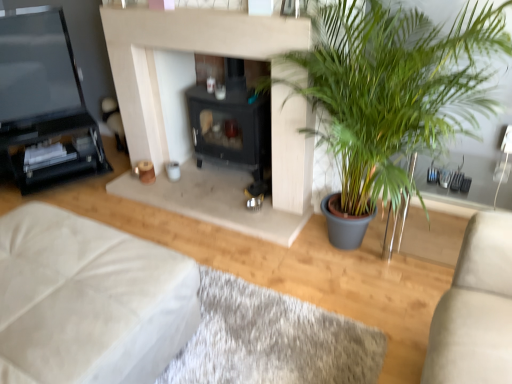
Describe the element at coordinates (42, 96) in the screenshot. I see `matte black tv at left` at that location.

Describe the element at coordinates (89, 301) in the screenshot. I see `white fabric ottoman at lower left` at that location.

Where is `matte black tv at left`? The height and width of the screenshot is (384, 512). matte black tv at left is located at coordinates (42, 96).

Where is `fireplace behind the green leafy plant at right`? fireplace behind the green leafy plant at right is located at coordinates (232, 122).

In the image, is green leafy plant at right on the left side or the right side of black matte fireplace at center?

Clearly, green leafy plant at right is on the right of black matte fireplace at center in the image.

Between green leafy plant at right and black matte fireplace at center, which one has larger size?

With larger size is green leafy plant at right.

From the image's perspective, is green leafy plant at right over black matte fireplace at center?

No.

From a real-world perspective, is white fabric at lower left positioned over black matte fireplace at center based on gravity?

No, from a real-world perspective, white fabric at lower left is not on top of black matte fireplace at center.

Identify the location of fireplace located behind the white fabric at lower left. The width and height of the screenshot is (512, 384). (232, 122).

Is white fabric at lower left directly adjacent to black matte fireplace at center?

No, white fabric at lower left is not next to black matte fireplace at center.

Based on their positions, is white fabric at lower left located to the left or right of black matte fireplace at center?

white fabric at lower left is to the left of black matte fireplace at center.

Can you confirm if green leafy plant at right is smaller than white fabric ottoman at lower left?

No.

Which object is positioned more to the right, green leafy plant at right or white fabric ottoman at lower left?

green leafy plant at right.

Which is in front, point (376, 80) or point (181, 305)?

Positioned in front is point (181, 305).

From the image's perspective, which object appears higher, green leafy plant at right or white fabric ottoman at lower left?

green leafy plant at right.

How much distance is there between white fabric ottoman at lower left and matte black tv at left?

They are 5.30 feet apart.

Can you tell me how much white fabric ottoman at lower left and matte black tv at left differ in facing direction?

The facing directions of white fabric ottoman at lower left and matte black tv at left are 151 degrees apart.

Who is smaller, white fabric ottoman at lower left or matte black tv at left?

With smaller size is matte black tv at left.

Is white fabric ottoman at lower left aimed at matte black tv at left?

No, white fabric ottoman at lower left is not turned towards matte black tv at left.

From the picture: Can you confirm if black matte fireplace at center is shorter than green leafy plant at right?

Correct, black matte fireplace at center is not as tall as green leafy plant at right.

Does black matte fireplace at center have a lesser width compared to green leafy plant at right?

Yes, black matte fireplace at center is thinner than green leafy plant at right.

This screenshot has width=512, height=384. I want to click on fireplace lying above the green leafy plant at right (from the image's perspective), so click(232, 122).

Does black matte fireplace at center have a larger size compared to green leafy plant at right?

No, black matte fireplace at center is not bigger than green leafy plant at right.

Is green leafy plant at right taller or shorter than white fabric at lower left?

Considering their sizes, green leafy plant at right has more height than white fabric at lower left.

Which is more to the right, green leafy plant at right or white fabric at lower left?

green leafy plant at right.

How distant is green leafy plant at right from white fabric at lower left?

The distance of green leafy plant at right from white fabric at lower left is 37.74 inches.

The image size is (512, 384). In order to click on houseplant above the white fabric at lower left (from a real-world perspective) in this screenshot , I will do `click(393, 89)`.

Is matte black tv at left positioned with its back to white fabric at lower left?

No, matte black tv at left is not facing the opposite direction of white fabric at lower left.

Could white fabric at lower left be considered to be inside matte black tv at left?

No, white fabric at lower left is not inside matte black tv at left.

Can you confirm if matte black tv at left is smaller than white fabric at lower left?

Incorrect, matte black tv at left is not smaller in size than white fabric at lower left.

You are a GUI agent. You are given a task and a screenshot of the screen. Output one action in this format:
    pyautogui.click(x=<x>, y=<y>)
    Task: Click on the houseplant above the black matte fireplace at center (from a real-world perspective)
    
    Given the screenshot: What is the action you would take?
    pyautogui.click(x=393, y=89)

The image size is (512, 384). In order to click on plain on the left side of black matte fireplace at center in this screenshot , I will do click(272, 339).

Estimate the real-world distances between objects in this image. Which object is closer to white fabric at lower left, green leafy plant at right or matte black tv at left?

green leafy plant at right.

From the image, which object appears to be nearer to green leafy plant at right, matte black tv at left or white fabric ottoman at lower left?

Among the two, white fabric ottoman at lower left is located nearer to green leafy plant at right.

From the picture: From the image, which object appears to be nearer to green leafy plant at right, white fabric at lower left or black matte fireplace at center?

Based on the image, black matte fireplace at center appears to be nearer to green leafy plant at right.

When comparing their distances from white fabric ottoman at lower left, does white fabric at lower left or green leafy plant at right seem further?

Based on the image, green leafy plant at right appears to be further to white fabric ottoman at lower left.

Estimate the real-world distances between objects in this image. Which object is closer to white fabric at lower left, green leafy plant at right or white fabric ottoman at lower left?

Based on the image, white fabric ottoman at lower left appears to be nearer to white fabric at lower left.

Based on the photo, when comparing their distances from green leafy plant at right, does white fabric at lower left or matte black tv at left seem closer?

white fabric at lower left is closer to green leafy plant at right.

Consider the image. Looking at the image, which one is located closer to white fabric ottoman at lower left, black matte fireplace at center or white fabric at lower left?

white fabric at lower left is positioned closer to the anchor white fabric ottoman at lower left.

Looking at the image, which one is located further to matte black tv at left, white fabric ottoman at lower left or black matte fireplace at center?

Based on the image, white fabric ottoman at lower left appears to be further to matte black tv at left.

Find the location of `plain between matte black tv at left and black matte fireplace at center from left to right`. plain between matte black tv at left and black matte fireplace at center from left to right is located at coordinates (272, 339).

Where is `studio couch between green leafy plant at right and black matte fireplace at center from front to back`? The height and width of the screenshot is (384, 512). studio couch between green leafy plant at right and black matte fireplace at center from front to back is located at coordinates (89, 301).

Identify the location of studio couch between matte black tv at left and green leafy plant at right. This screenshot has width=512, height=384. (89, 301).

In order to click on plain between white fabric ottoman at lower left and black matte fireplace at center along the z-axis in this screenshot , I will do `click(272, 339)`.